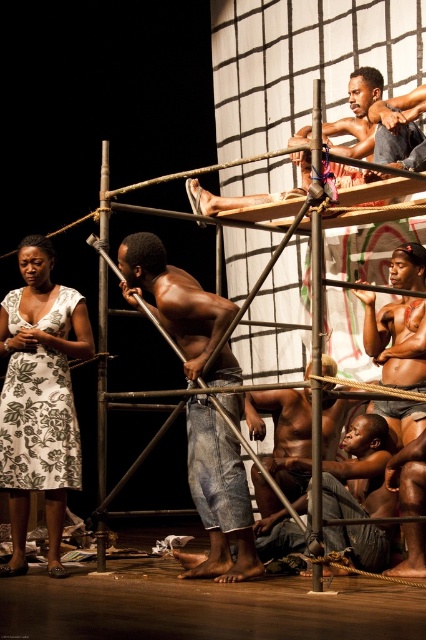
You are an actor on stage and need to quickly move to the denim jeans at center from your current position at point (218, 496). What direction should you move in?

The point (218, 496) is where the denim jeans at center are located, so you are already at the correct position.

You are a stagehand responsible for ensuring the actors and props are positioned correctly. You notice the shiny brown skin at center and the shiny metallic pole at center. Which object is narrower when viewed from the front?

The shiny brown skin at center is narrower than the shiny metallic pole at center.